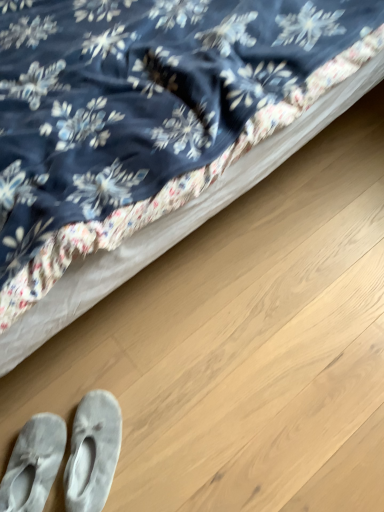
Where is `gray suede slippers at lower left, the 2th footwear viewed from the right`? This screenshot has width=384, height=512. gray suede slippers at lower left, the 2th footwear viewed from the right is located at coordinates (33, 464).

The height and width of the screenshot is (512, 384). What do you see at coordinates (93, 452) in the screenshot?
I see `light gray suede slippers at lower left, which is the 1th footwear in right-to-left order` at bounding box center [93, 452].

Where is `gray suede slippers at lower left, acting as the first footwear starting from the left`? This screenshot has height=512, width=384. gray suede slippers at lower left, acting as the first footwear starting from the left is located at coordinates (33, 464).

From the image's perspective, is velvety blue bed at upper left below light gray suede slippers at lower left, arranged as the second footwear when viewed from the left?

No, from the image's perspective, velvety blue bed at upper left is not beneath light gray suede slippers at lower left, arranged as the second footwear when viewed from the left.

Based on the photo, considering their positions, is velvety blue bed at upper left located in front of or behind light gray suede slippers at lower left, arranged as the second footwear when viewed from the left?

velvety blue bed at upper left is positioned closer to the viewer than light gray suede slippers at lower left, arranged as the second footwear when viewed from the left.

Considering the relative positions of velvety blue bed at upper left and light gray suede slippers at lower left, arranged as the second footwear when viewed from the left, in the image provided, is velvety blue bed at upper left to the left of light gray suede slippers at lower left, arranged as the second footwear when viewed from the left, from the viewer's perspective?

Correct, you'll find velvety blue bed at upper left to the left of light gray suede slippers at lower left, arranged as the second footwear when viewed from the left.

From the picture: Can you confirm if velvety blue bed at upper left is thinner than light gray suede slippers at lower left, arranged as the second footwear when viewed from the left?

In fact, velvety blue bed at upper left might be wider than light gray suede slippers at lower left, arranged as the second footwear when viewed from the left.

Are gray suede slippers at lower left, the 2th footwear viewed from the right, and light gray suede slippers at lower left, arranged as the second footwear when viewed from the left, beside each other?

Yes, gray suede slippers at lower left, the 2th footwear viewed from the right, is with light gray suede slippers at lower left, arranged as the second footwear when viewed from the left.

Is gray suede slippers at lower left, the 2th footwear viewed from the right, aimed at light gray suede slippers at lower left, which is the 1th footwear in right-to-left order?

No, gray suede slippers at lower left, the 2th footwear viewed from the right, is not turned towards light gray suede slippers at lower left, which is the 1th footwear in right-to-left order.

In the image, is gray suede slippers at lower left, the 2th footwear viewed from the right, on the left side or the right side of light gray suede slippers at lower left, arranged as the second footwear when viewed from the left?

Based on their positions, gray suede slippers at lower left, the 2th footwear viewed from the right, is located to the left of light gray suede slippers at lower left, arranged as the second footwear when viewed from the left.

From a real-world perspective, does gray suede slippers at lower left, the 2th footwear viewed from the right, stand above light gray suede slippers at lower left, arranged as the second footwear when viewed from the left?

No, from a real-world perspective, gray suede slippers at lower left, the 2th footwear viewed from the right, is not on top of light gray suede slippers at lower left, arranged as the second footwear when viewed from the left.

At what (x,y) coordinates should I click in order to perform the action: click on footwear behind the gray suede slippers at lower left, the 2th footwear viewed from the right. Please return your answer as a coordinate pair (x, y). This screenshot has width=384, height=512. Looking at the image, I should click on (93, 452).

Is light gray suede slippers at lower left, arranged as the second footwear when viewed from the left, to the right of gray suede slippers at lower left, the 2th footwear viewed from the right, from the viewer's perspective?

Yes.

Considering the relative sizes of light gray suede slippers at lower left, which is the 1th footwear in right-to-left order, and gray suede slippers at lower left, acting as the first footwear starting from the left, in the image provided, is light gray suede slippers at lower left, which is the 1th footwear in right-to-left order, smaller than gray suede slippers at lower left, acting as the first footwear starting from the left,?

Yes.

Is light gray suede slippers at lower left, arranged as the second footwear when viewed from the left, turned away from gray suede slippers at lower left, acting as the first footwear starting from the left?

No, light gray suede slippers at lower left, arranged as the second footwear when viewed from the left,'s orientation is not away from gray suede slippers at lower left, acting as the first footwear starting from the left.

Which is more distant, (42,435) or (32,219)?

The point (42,435) is more distant.

Can you confirm if gray suede slippers at lower left, the 2th footwear viewed from the right, is taller than velvety blue bed at upper left?

In fact, gray suede slippers at lower left, the 2th footwear viewed from the right, may be shorter than velvety blue bed at upper left.

Is gray suede slippers at lower left, the 2th footwear viewed from the right, bigger or smaller than velvety blue bed at upper left?

gray suede slippers at lower left, the 2th footwear viewed from the right, is smaller than velvety blue bed at upper left.

Who is shorter, velvety blue bed at upper left or gray suede slippers at lower left, the 2th footwear viewed from the right?

gray suede slippers at lower left, the 2th footwear viewed from the right.

Considering the sizes of objects velvety blue bed at upper left and gray suede slippers at lower left, acting as the first footwear starting from the left, in the image provided, who is thinner, velvety blue bed at upper left or gray suede slippers at lower left, acting as the first footwear starting from the left,?

gray suede slippers at lower left, acting as the first footwear starting from the left, is thinner.

From a real-world perspective, which object stands above the other?

velvety blue bed at upper left.

From the image's perspective, is velvety blue bed at upper left located beneath gray suede slippers at lower left, the 2th footwear viewed from the right?

No.

Does light gray suede slippers at lower left, which is the 1th footwear in right-to-left order, have a greater width compared to velvety blue bed at upper left?

No, light gray suede slippers at lower left, which is the 1th footwear in right-to-left order, is not wider than velvety blue bed at upper left.

Considering the sizes of objects light gray suede slippers at lower left, arranged as the second footwear when viewed from the left, and velvety blue bed at upper left in the image provided, who is shorter, light gray suede slippers at lower left, arranged as the second footwear when viewed from the left, or velvety blue bed at upper left?

light gray suede slippers at lower left, arranged as the second footwear when viewed from the left.

Is light gray suede slippers at lower left, which is the 1th footwear in right-to-left order, facing away from velvety blue bed at upper left?

Yes, light gray suede slippers at lower left, which is the 1th footwear in right-to-left order,'s orientation is away from velvety blue bed at upper left.

Locate an element on the screen. This screenshot has width=384, height=512. the 1st footwear positioned below the velvety blue bed at upper left (from the image's perspective) is located at coordinates (93, 452).

The width and height of the screenshot is (384, 512). In order to click on footwear that is the 2nd one when counting backward from the velvety blue bed at upper left in this screenshot , I will do `click(93, 452)`.

I want to click on footwear above the gray suede slippers at lower left, acting as the first footwear starting from the left (from the image's perspective), so [93, 452].

Looking at the image, which one is located closer to gray suede slippers at lower left, acting as the first footwear starting from the left, light gray suede slippers at lower left, which is the 1th footwear in right-to-left order, or velvety blue bed at upper left?

light gray suede slippers at lower left, which is the 1th footwear in right-to-left order, is closer to gray suede slippers at lower left, acting as the first footwear starting from the left.

Considering their positions, is gray suede slippers at lower left, acting as the first footwear starting from the left, positioned further to velvety blue bed at upper left than light gray suede slippers at lower left, which is the 1th footwear in right-to-left order?

Based on the image, gray suede slippers at lower left, acting as the first footwear starting from the left, appears to be further to velvety blue bed at upper left.

Based on their spatial positions, is light gray suede slippers at lower left, which is the 1th footwear in right-to-left order, or gray suede slippers at lower left, acting as the first footwear starting from the left, closer to velvety blue bed at upper left?

light gray suede slippers at lower left, which is the 1th footwear in right-to-left order, lies closer to velvety blue bed at upper left than the other object.

Which object lies nearer to the anchor point light gray suede slippers at lower left, which is the 1th footwear in right-to-left order, gray suede slippers at lower left, acting as the first footwear starting from the left, or velvety blue bed at upper left?

Based on the image, gray suede slippers at lower left, acting as the first footwear starting from the left, appears to be nearer to light gray suede slippers at lower left, which is the 1th footwear in right-to-left order.

Estimate the real-world distances between objects in this image. Which object is closer to gray suede slippers at lower left, acting as the first footwear starting from the left, velvety blue bed at upper left or light gray suede slippers at lower left, which is the 1th footwear in right-to-left order?

Based on the image, light gray suede slippers at lower left, which is the 1th footwear in right-to-left order, appears to be nearer to gray suede slippers at lower left, acting as the first footwear starting from the left.

When comparing their distances from light gray suede slippers at lower left, which is the 1th footwear in right-to-left order, does velvety blue bed at upper left or gray suede slippers at lower left, acting as the first footwear starting from the left, seem closer?

gray suede slippers at lower left, acting as the first footwear starting from the left.

The image size is (384, 512). I want to click on footwear between velvety blue bed at upper left and gray suede slippers at lower left, the 2th footwear viewed from the right, vertically, so click(93, 452).